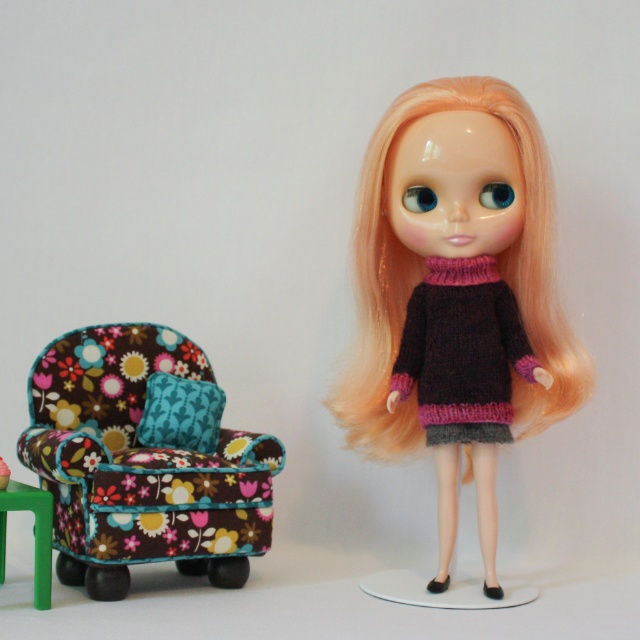
Consider the image. What are the coordinates of the black knitted sweater at center?

The black knitted sweater at center is located at coordinates point (461, 352).

You are planning to place a new decorative pillow on either the floral fabric armchair at left or the black knitted sweater at center. Which object would allow the pillow to fit better based on their sizes?

The floral fabric armchair at left is bigger than the black knitted sweater at center, so the pillow would fit better on the floral fabric armchair at left.